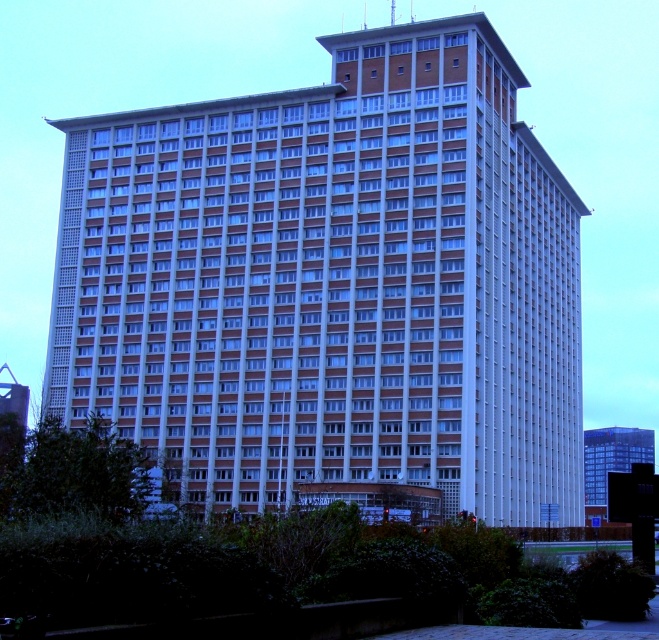
Which is more to the left, white brick building at center or glassy blue skyscraper at center?

white brick building at center

Is white brick building at center below glassy blue skyscraper at center?

No, white brick building at center is not below glassy blue skyscraper at center.

Is point (272, 256) positioned before point (606, 474)?

Yes, point (272, 256) is closer to viewer.

You are a GUI agent. You are given a task and a screenshot of the screen. Output one action in this format:
    pyautogui.click(x=<x>, y=<y>)
    Task: Click on the white brick building at center
    This screenshot has height=640, width=659.
    Given the screenshot: What is the action you would take?
    pyautogui.click(x=331, y=285)